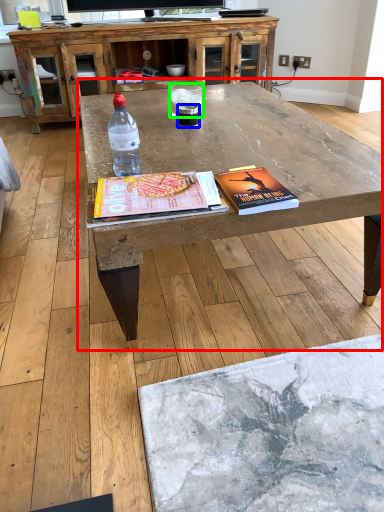
Question: Which object is the closest to the coffee table (highlighted by a red box)? Choose among these: beverage (highlighted by a blue box) or water (highlighted by a green box).

Choices:
 (A) beverage
 (B) water

Answer: (B)